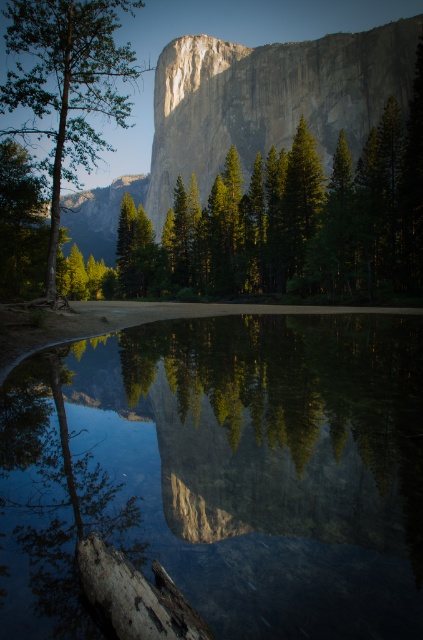
You are standing in the serene landscape and want to take a photo of the green matte tree at left and the transparent glass water at center. Which object is closer to you, the photographer?

The green matte tree at left is closer to you because the transparent glass water at center is positioned under it, meaning the tree is in front of the water.

You are standing in front of the scene and want to take a photo that includes both the transparent glass water at center and the green matte tree at left. Which object will appear larger in the photo?

The transparent glass water at center will appear larger in the photo because it is closer to the viewer than the green matte tree at left.

You are standing in the landscape and want to take a photo of both the granite cliff at center and the green matte tree at left. Which object should you focus on first to ensure both are in clear view?

You should focus on the green matte tree at left first because it is closer to you than the granite cliff at center, ensuring both will be in focus when using a camera with a fixed focal point.